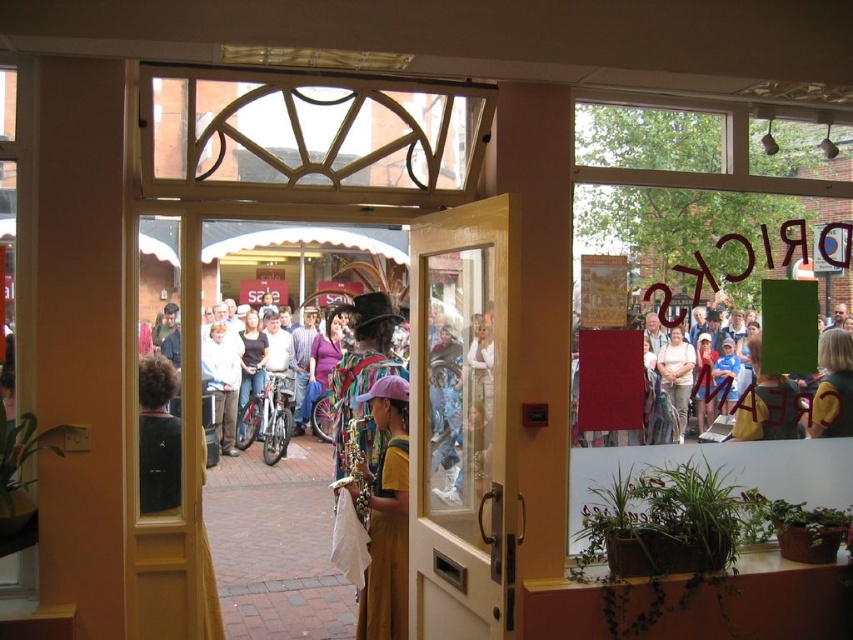
You are standing in front of the doorway and want to know which of the two points, point (276, 332) or point (297, 412), is closer to you. Can you determine this based on the scene?

Point (276, 332) is closer to you than point (297, 412) because it is further to the viewer according to the description.

You are a delivery person trying to enter through the doorway. The doorway has a width of 1 meter. You have a matte white bicycle at center and a denim jacket at center. Which object can you bring through the doorway without needing to remove it?

The matte white bicycle at center is bigger than the denim jacket at center, so the denim jacket at center can be brought through the doorway without needing to remove it since it is smaller than the doorway width of 1 meter.

You are a photographer trying to capture a candid shot of the crowd through the doorway. You notice the matte yellow dress at center and the light brown hair at center. Which object would you need to focus on first if you want to ensure both are in the frame without moving the camera?

The matte yellow dress at center is bigger than the light brown hair at center, so you should focus on the matte yellow dress at center first to ensure it fills the frame appropriately before adjusting for the smaller light brown hair at center.